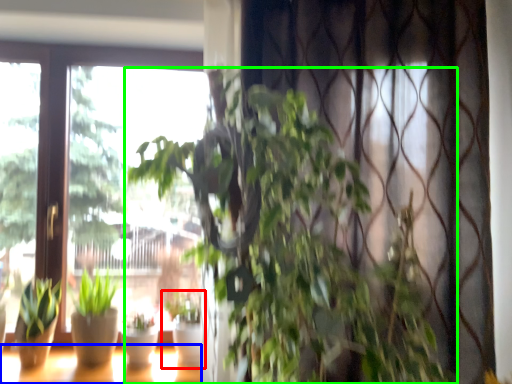
Question: Considering the real-world distances, which object is farthest from houseplant (highlighted by a red box)? window (highlighted by a blue box) or houseplant (highlighted by a green box)?

Choices:
 (A) window
 (B) houseplant

Answer: (B)